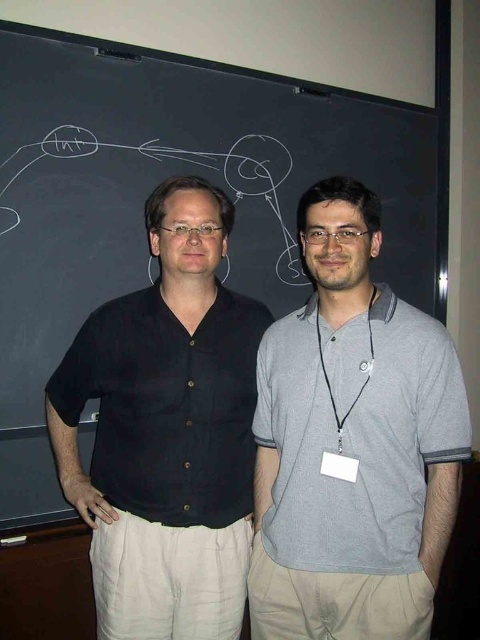
Question: Does gray cotton polo shirt at center have a smaller size compared to black cotton shirt at left?

Choices:
 (A) yes
 (B) no

Answer: (A)

Question: Among these objects, which one is farthest from the camera?

Choices:
 (A) gray cotton polo shirt at center
 (B) black cotton shirt at left

Answer: (B)

Question: Is gray cotton polo shirt at center thinner than black cotton shirt at left?

Choices:
 (A) yes
 (B) no

Answer: (A)

Question: Which point is farther from the camera taking this photo?

Choices:
 (A) [x=122, y=403]
 (B) [x=420, y=497]

Answer: (A)

Question: Observing the image, what is the correct spatial positioning of gray cotton polo shirt at center in reference to black cotton shirt at left?

Choices:
 (A) left
 (B) right

Answer: (B)